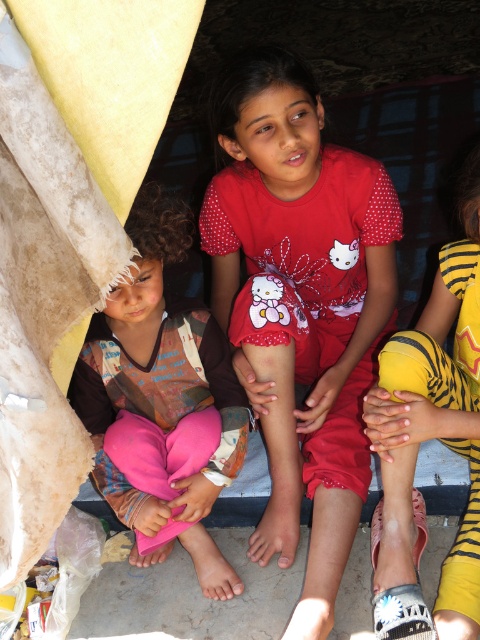
Question: Which object is the farthest from the pink fabric pants at left?

Choices:
 (A) red matte shirt at center
 (B) yellow tiger-patterned pants at lower right

Answer: (B)

Question: Estimate the real-world distances between objects in this image. Which object is closer to the pink fabric pants at left?

Choices:
 (A) yellow tiger-patterned pants at lower right
 (B) red matte shirt at center

Answer: (B)

Question: Estimate the real-world distances between objects in this image. Which object is closer to the red matte shirt at center?

Choices:
 (A) yellow tiger-patterned pants at lower right
 (B) pink fabric pants at left

Answer: (B)

Question: Does pink fabric pants at left have a larger size compared to yellow tiger-patterned pants at lower right?

Choices:
 (A) yes
 (B) no

Answer: (A)

Question: Does pink fabric pants at left have a greater width compared to yellow tiger-patterned pants at lower right?

Choices:
 (A) no
 (B) yes

Answer: (B)

Question: Does pink fabric pants at left have a larger size compared to yellow tiger-patterned pants at lower right?

Choices:
 (A) yes
 (B) no

Answer: (A)